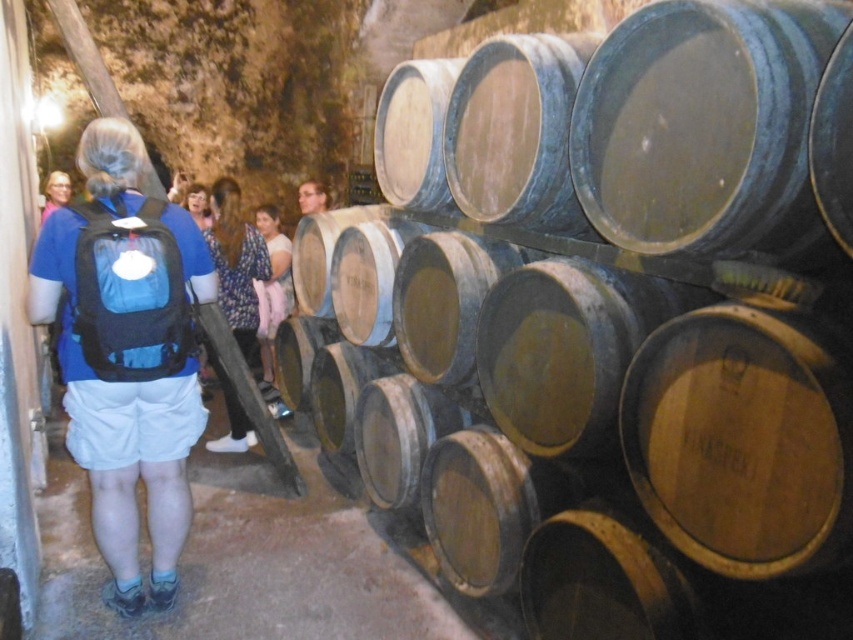
Question: Among these objects, which one is nearest to the camera?

Choices:
 (A) matte brown hair at upper center
 (B) matte blue backpack at center

Answer: (A)

Question: Is floral dress at center to the left of blue backpack at center from the viewer's perspective?

Choices:
 (A) no
 (B) yes

Answer: (A)

Question: Can you confirm if wooden barrel at center is wider than blue backpack at center?

Choices:
 (A) no
 (B) yes

Answer: (B)

Question: Which point is farther from the camera taking this photo?

Choices:
 (A) (672, 493)
 (B) (268, 212)
 (C) (315, 182)
 (D) (55, 184)

Answer: (D)

Question: Does wooden barrel at center have a lesser width compared to matte blue backpack at center?

Choices:
 (A) yes
 (B) no

Answer: (B)

Question: Which of the following is the farthest from the observer?

Choices:
 (A) (96, 436)
 (B) (328, 198)

Answer: (B)